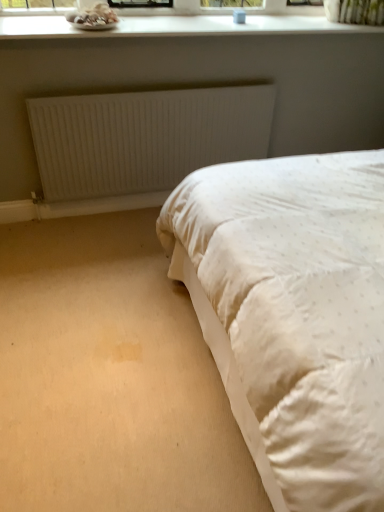
At what (x,y) coordinates should I click in order to perform the action: click on white matte radiator at upper center. Please return your answer as a coordinate pair (x, y). Image resolution: width=384 pixels, height=512 pixels. Looking at the image, I should click on (144, 137).

What do you see at coordinates (144, 137) in the screenshot? This screenshot has width=384, height=512. I see `white matte radiator at upper center` at bounding box center [144, 137].

You are a GUI agent. You are given a task and a screenshot of the screen. Output one action in this format:
    pyautogui.click(x=<x>, y=<y>)
    Task: Click on the white smooth window sill at upper center
    The width and height of the screenshot is (384, 512).
    Given the screenshot: What is the action you would take?
    pyautogui.click(x=177, y=26)

The height and width of the screenshot is (512, 384). What do you see at coordinates (177, 26) in the screenshot? I see `white smooth window sill at upper center` at bounding box center [177, 26].

What is the approximate height of white smooth window sill at upper center?

2.74 inches.

The height and width of the screenshot is (512, 384). In order to click on white matte radiator at upper center in this screenshot , I will do `click(144, 137)`.

Is white smooth window sill at upper center to the right of white matte radiator at upper center from the viewer's perspective?

Correct, you'll find white smooth window sill at upper center to the right of white matte radiator at upper center.

Is white smooth window sill at upper center further to camera compared to white matte radiator at upper center?

No, the depth of white smooth window sill at upper center is less than that of white matte radiator at upper center.

Is point (297, 23) less distant than point (147, 96)?

No, (297, 23) is further to viewer.

From the image's perspective, which is above, white smooth window sill at upper center or white matte radiator at upper center?

From the image's view, white smooth window sill at upper center is above.

From a real-world perspective, relative to white matte radiator at upper center, is white smooth window sill at upper center vertically above or below?

white smooth window sill at upper center is situated higher than white matte radiator at upper center in the real world.

Considering the relative sizes of white smooth window sill at upper center and white matte radiator at upper center in the image provided, is white smooth window sill at upper center wider than white matte radiator at upper center?

Yes, white smooth window sill at upper center is wider than white matte radiator at upper center.

From the picture: Considering the relative sizes of white smooth window sill at upper center and white matte radiator at upper center in the image provided, is white smooth window sill at upper center shorter than white matte radiator at upper center?

Yes.

Is white smooth window sill at upper center smaller than white matte radiator at upper center?

No, white smooth window sill at upper center is not smaller than white matte radiator at upper center.

Is white smooth window sill at upper center not inside white matte radiator at upper center?

Yes, white smooth window sill at upper center is not within white matte radiator at upper center.

Is white smooth window sill at upper center far from white matte radiator at upper center?

That's not correct — white smooth window sill at upper center is a little close to white matte radiator at upper center.

Is white smooth window sill at upper center facing away from white matte radiator at upper center?

No.

Can you tell me how much white smooth window sill at upper center and white matte radiator at upper center differ in facing direction?

The angle between the facing direction of white smooth window sill at upper center and the facing direction of white matte radiator at upper center is 0.113 degrees.

Locate an element on the screen. This screenshot has width=384, height=512. window sill on the right of white matte radiator at upper center is located at coordinates (177, 26).

Visually, is white matte radiator at upper center positioned to the left or to the right of white smooth window sill at upper center?

In the image, white matte radiator at upper center appears on the left side of white smooth window sill at upper center.

In the image, is white matte radiator at upper center positioned in front of or behind white smooth window sill at upper center?

Clearly, white matte radiator at upper center is behind white smooth window sill at upper center.

Does point (196, 98) come closer to viewer compared to point (252, 30)?

No.

From the image's perspective, is white matte radiator at upper center on top of white smooth window sill at upper center?

No, from the image's perspective, white matte radiator at upper center is not over white smooth window sill at upper center.

From a real-world perspective, does white matte radiator at upper center stand above white smooth window sill at upper center?

Incorrect, from a real-world perspective, white matte radiator at upper center is lower than white smooth window sill at upper center.

Considering the relative sizes of white matte radiator at upper center and white smooth window sill at upper center in the image provided, is white matte radiator at upper center thinner than white smooth window sill at upper center?

Correct, the width of white matte radiator at upper center is less than that of white smooth window sill at upper center.

From their relative heights in the image, would you say white matte radiator at upper center is taller or shorter than white smooth window sill at upper center?

In the image, white matte radiator at upper center appears to be taller than white smooth window sill at upper center.

Does white matte radiator at upper center have a smaller size compared to white smooth window sill at upper center?

Yes.

Is white matte radiator at upper center located outside white smooth window sill at upper center?

Yes, white matte radiator at upper center is not within white smooth window sill at upper center.

Is white matte radiator at upper center not near white smooth window sill at upper center?

white matte radiator at upper center is near white smooth window sill at upper center, not far away.

Is white matte radiator at upper center aimed at white smooth window sill at upper center?

No, white matte radiator at upper center is not aimed at white smooth window sill at upper center.

What's the angular difference between white matte radiator at upper center and white smooth window sill at upper center's facing directions?

0.113 degrees.

This screenshot has width=384, height=512. Identify the location of window sill on the right of white matte radiator at upper center. click(177, 26).

Image resolution: width=384 pixels, height=512 pixels. I want to click on window sill lying above the white matte radiator at upper center (from the image's perspective), so click(x=177, y=26).

The height and width of the screenshot is (512, 384). I want to click on window sill above the white matte radiator at upper center (from a real-world perspective), so click(177, 26).